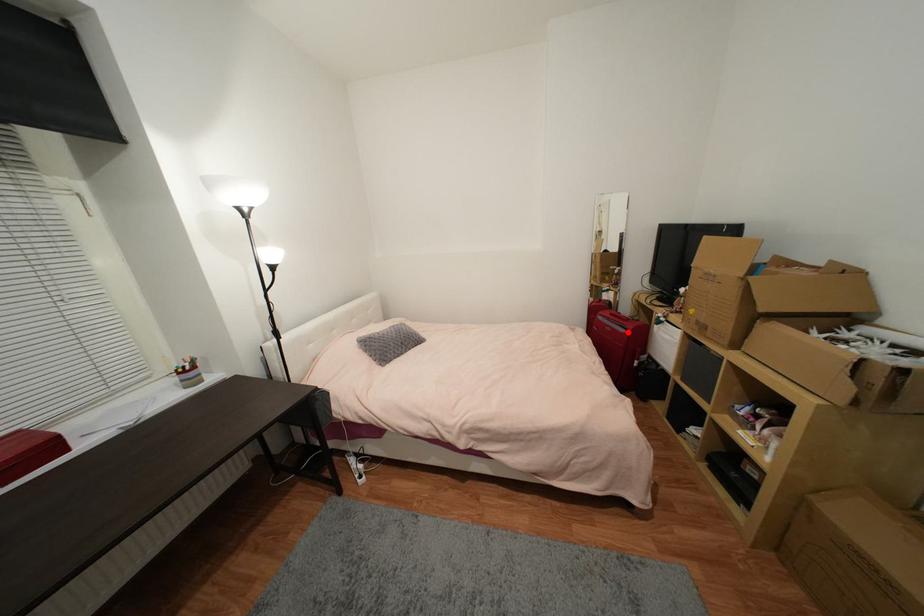
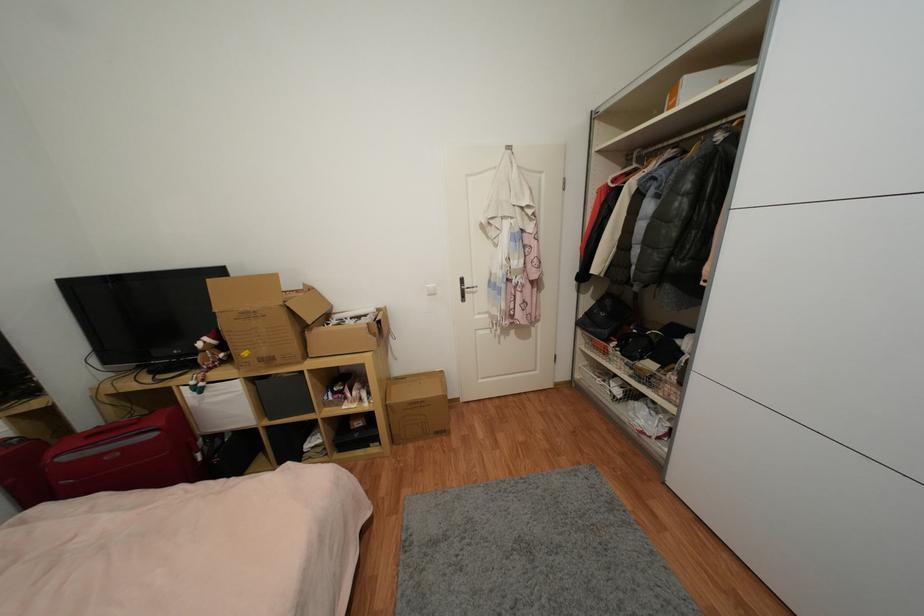
The point at the highlighted location is marked in the first image. Where is the corresponding point in the second image?

(157, 436)